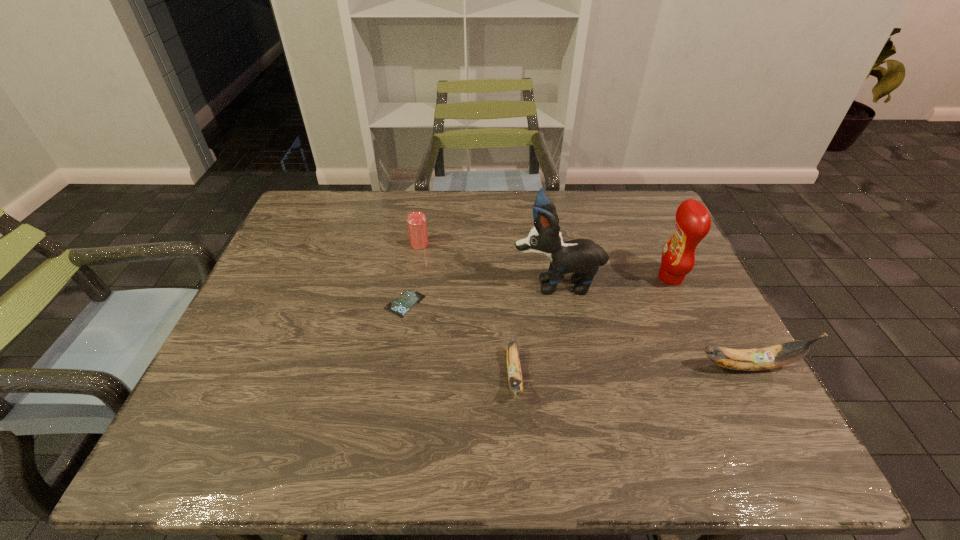
Locate an element on the screen. The width and height of the screenshot is (960, 540). free spot between the left banana and the farthest object is located at coordinates (467, 310).

At what (x,y) coordinates should I click in order to perform the action: click on vacant area that lies between the fourth shortest object and the condiment. Please return your answer as a coordinate pair (x, y). This screenshot has width=960, height=540. Looking at the image, I should click on (708, 322).

Identify the location of free space between the puppy and the farthest object. Image resolution: width=960 pixels, height=540 pixels. (488, 264).

The height and width of the screenshot is (540, 960). I want to click on free space between the second tallest object and the identity card, so click(538, 291).

Find the location of `free space between the tallest object and the condiment`. free space between the tallest object and the condiment is located at coordinates (613, 280).

I want to click on free spot between the second tallest object and the taller banana, so click(x=708, y=322).

Identify which object is the third nearest to the condiment. Please provide its 2D coordinates. Your answer should be formatted as a tuple, i.e. [(x, y)], where the tuple contains the x and y coordinates of a point satisfying the conditions above.

[(514, 372)]

Where is `object that is the third closest to the left banana`? Image resolution: width=960 pixels, height=540 pixels. object that is the third closest to the left banana is located at coordinates (783, 354).

You are a GUI agent. You are given a task and a screenshot of the screen. Output one action in this format:
    pyautogui.click(x=<x>, y=<y>)
    Task: Click on the free location that satisfies the following two spatial constraints: 1. at the stem of the taller banana; 2. at the stem of the left banana
    
    Given the screenshot: What is the action you would take?
    pyautogui.click(x=752, y=376)